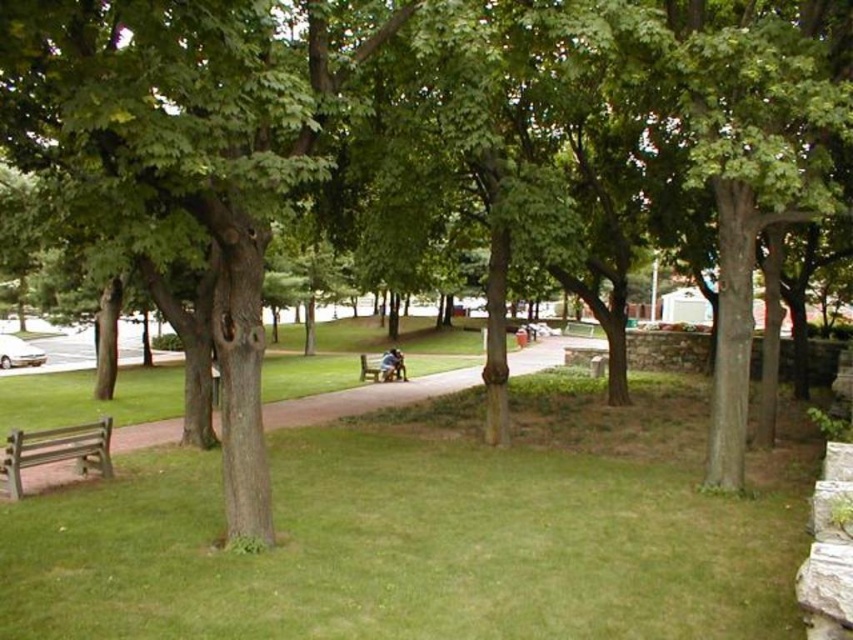
Does point (325, 406) lie behind point (364, 369)?

No, it is not.

Between point (346, 413) and point (387, 371), which one is positioned behind?

The point (387, 371) is behind.

The width and height of the screenshot is (853, 640). What do you see at coordinates (364, 397) in the screenshot? I see `brown wooden bench at lower left` at bounding box center [364, 397].

Image resolution: width=853 pixels, height=640 pixels. In order to click on brown wooden bench at lower left in this screenshot , I will do `click(364, 397)`.

Does brown wooden bench at lower left have a smaller size compared to wooden bench at lower left?

No.

In order to click on brown wooden bench at lower left in this screenshot , I will do 364,397.

Does wooden bench at lower left lie behind wooden park bench at center?

No, it is in front of wooden park bench at center.

Does point (16, 451) come behind point (397, 364)?

No, (16, 451) is closer to viewer.

Measure the distance between point (3, 470) and camera.

They are 8.51 meters apart.

Locate an element on the screen. The width and height of the screenshot is (853, 640). wooden bench at lower left is located at coordinates (55, 452).